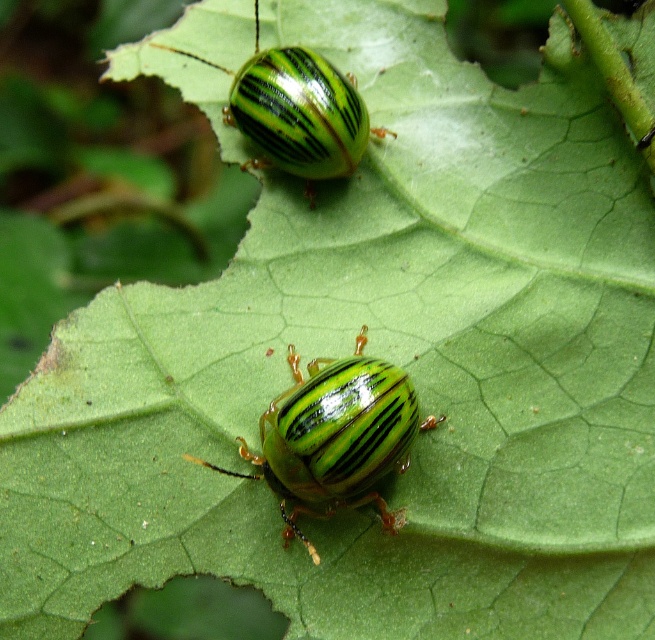
You are a gardener who wants to place a small sticker between the two beetles to mark their location. The sticker is 2 inches wide. Can you fit the sticker between the green glossy beetle at center and the green glossy beetle at upper center without overlapping them?

The distance between the green glossy beetle at center and the green glossy beetle at upper center is 13.38 inches. Since the sticker is only 2 inches wide, there is sufficient space to place it between them without overlapping either beetle.

You are a photographer trying to capture a closeup of the beetles on the leaf. You notice two points marked on your screen at coordinates point (384, 506) and point (337, 90). Which point should you focus on to ensure the beetle at that position is in sharp focus if you want the closest one to the camera to be clear?

You should focus on point (384, 506) because it is closer to the camera than point (337, 90), ensuring the beetle there will be in sharp focus.